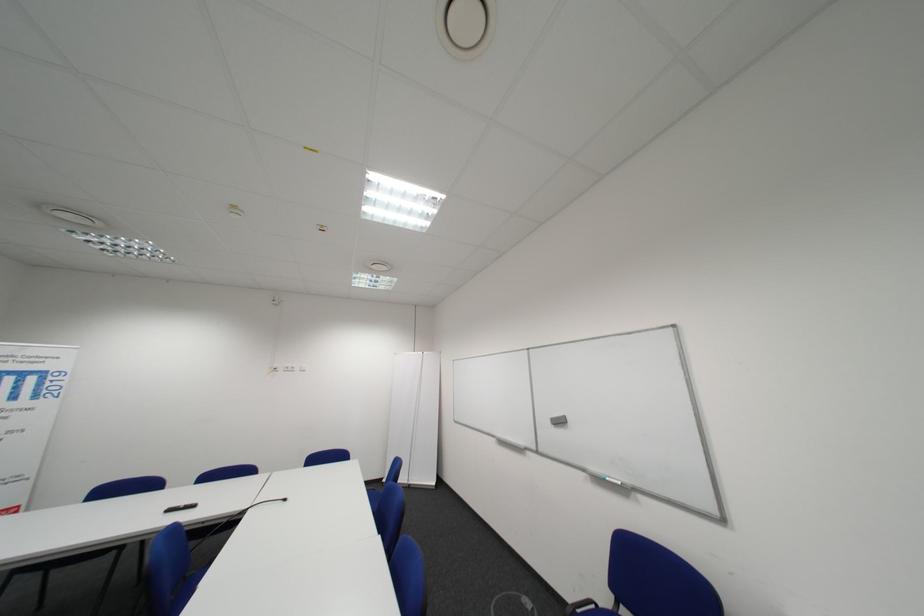
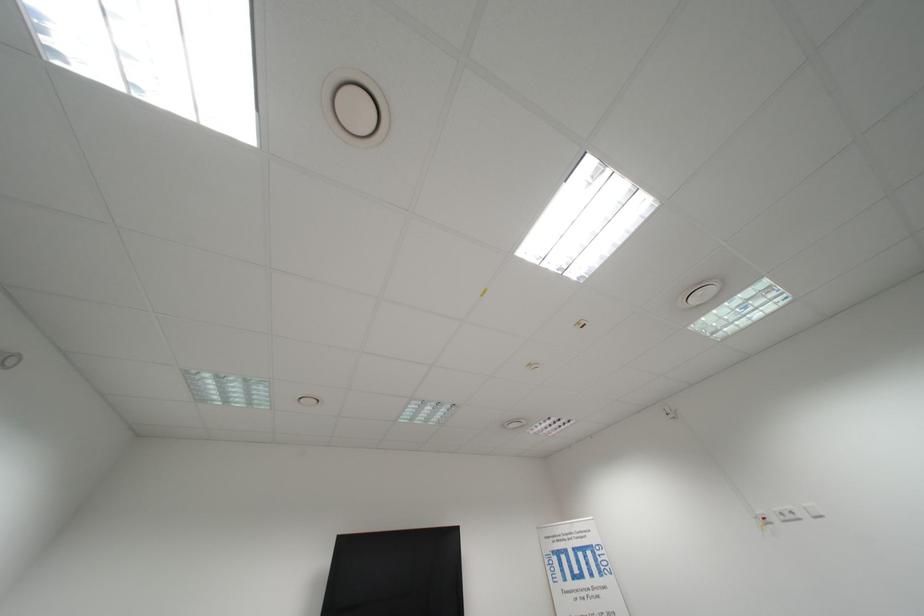
How did the camera likely rotate?

The camera rotated toward left-up.